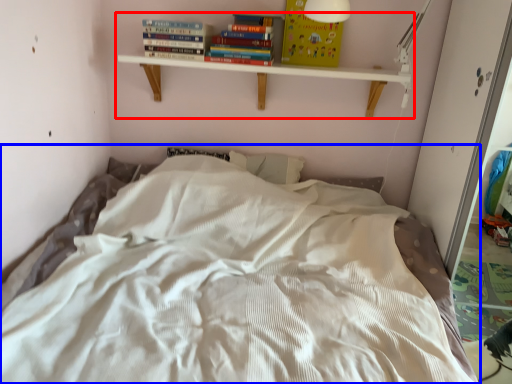
Question: Which object is closer to the camera taking this photo, shelf (highlighted by a red box) or bed (highlighted by a blue box)?

Choices:
 (A) shelf
 (B) bed

Answer: (B)